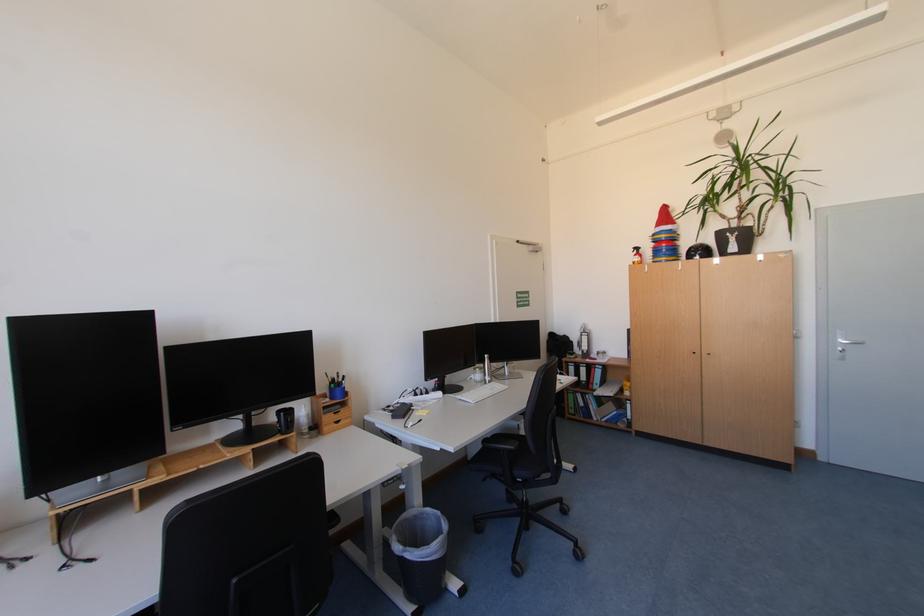
At what (x,y) coordinates should I click in order to perform the action: click on orange spray bottle. Please return your answer as a coordinate pair (x, y). The width and height of the screenshot is (924, 616). Looking at the image, I should click on (637, 254).